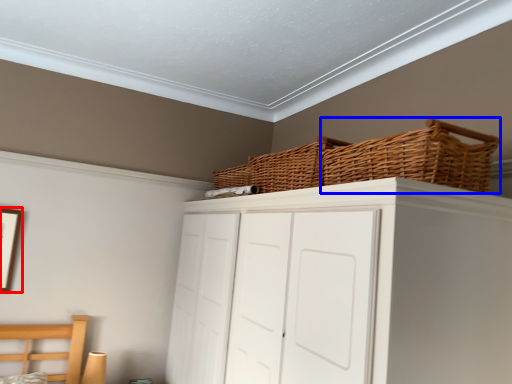
Question: Which point is further to the camera, picture frame (highlighted by a red box) or basket (highlighted by a blue box)?

Choices:
 (A) picture frame
 (B) basket

Answer: (A)